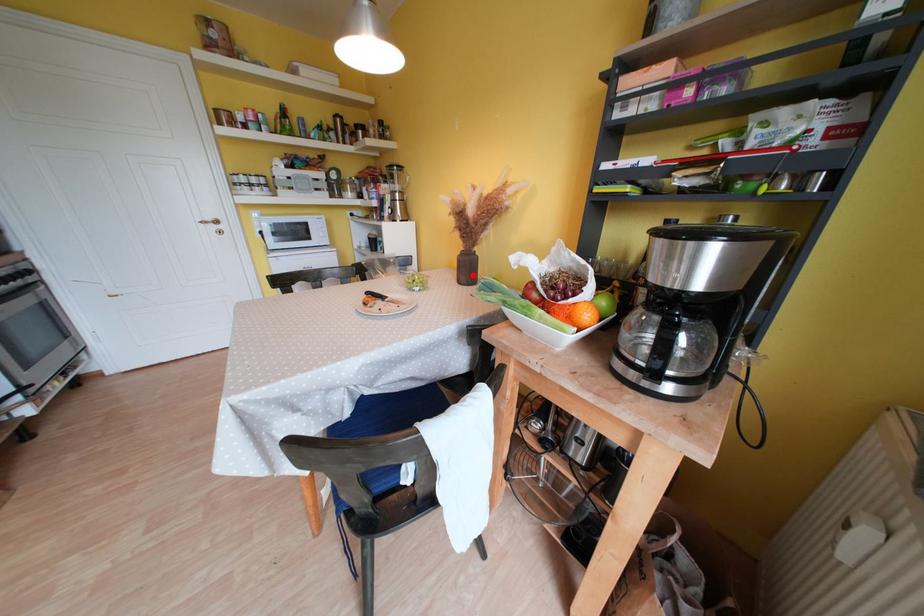
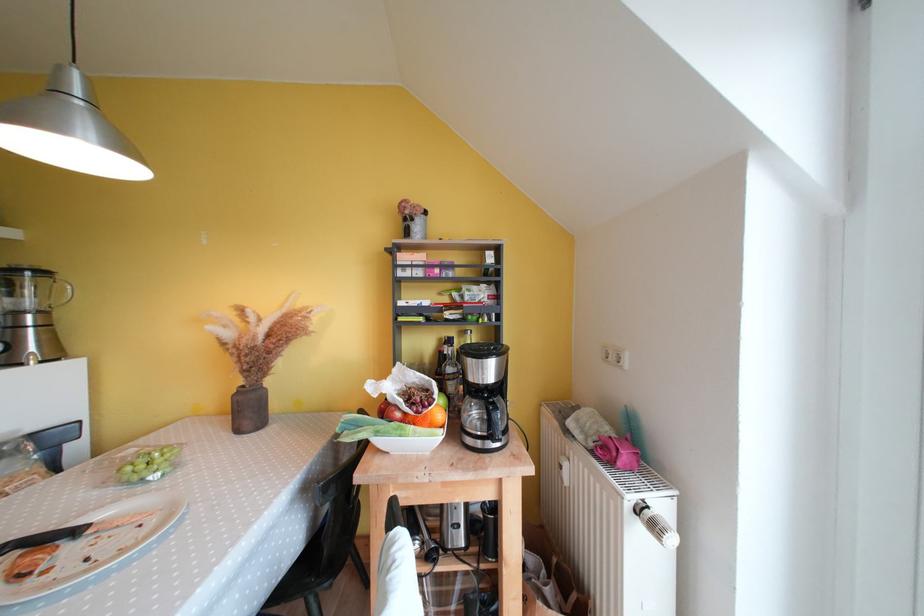
Where in the second image is the point corresponding to the highlighted location from the first image?

(256, 416)